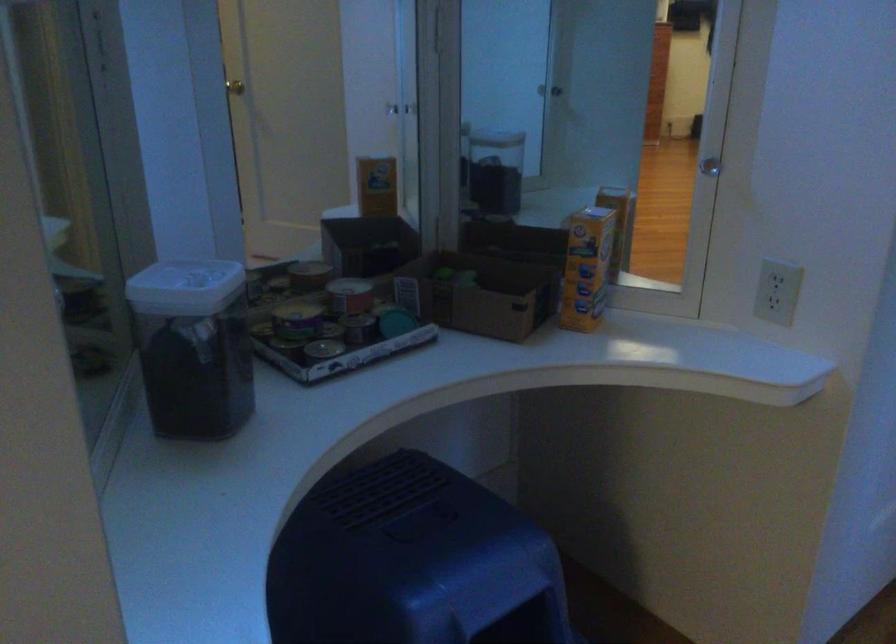
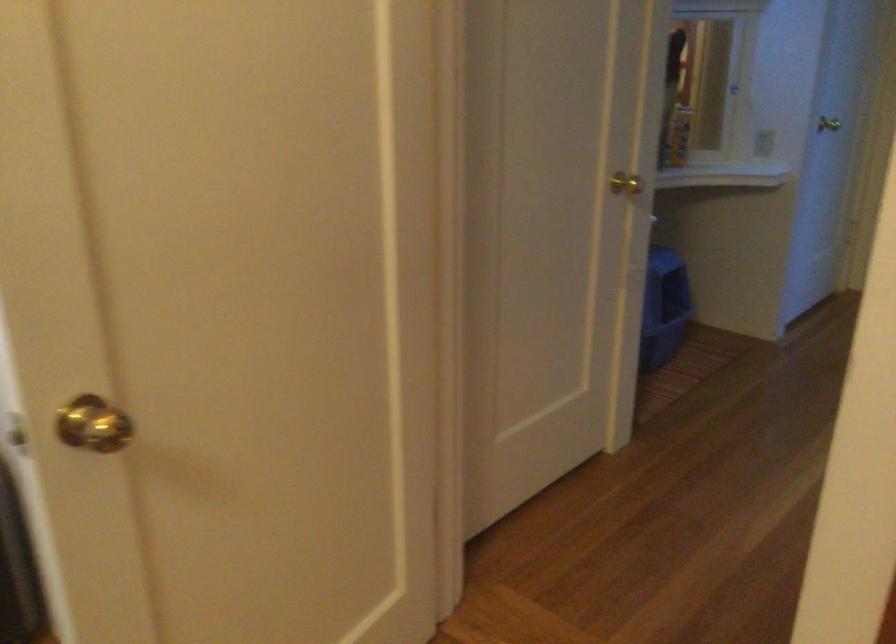
Locate, in the second image, the point that corresponds to (x=782, y=298) in the first image.

(762, 143)